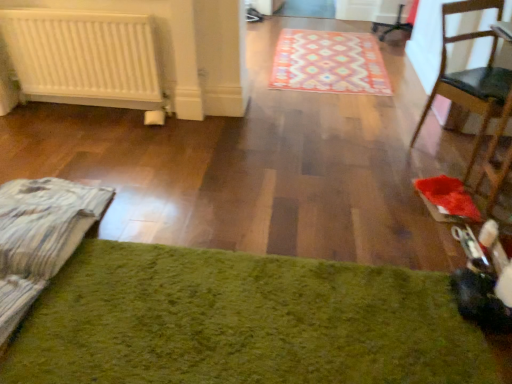
Image resolution: width=512 pixels, height=384 pixels. I want to click on vacant space situated above green shaggy rug at lower center, which is the first mat from bottom to top (from a real-world perspective), so click(x=238, y=309).